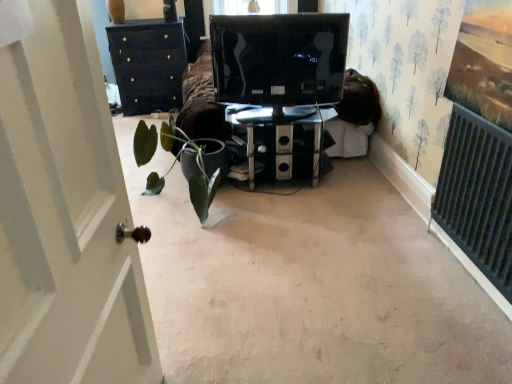
Question: Is transparent glass table at center positioned far away from green matte plant at center?

Choices:
 (A) no
 (B) yes

Answer: (A)

Question: Is transparent glass table at center positioned behind green matte plant at center?

Choices:
 (A) yes
 (B) no

Answer: (A)

Question: From the image's perspective, would you say transparent glass table at center is shown under green matte plant at center?

Choices:
 (A) yes
 (B) no

Answer: (B)

Question: Is transparent glass table at center at the left side of green matte plant at center?

Choices:
 (A) yes
 (B) no

Answer: (B)

Question: From a real-world perspective, does transparent glass table at center stand above green matte plant at center?

Choices:
 (A) yes
 (B) no

Answer: (B)

Question: Can you confirm if transparent glass table at center is smaller than green matte plant at center?

Choices:
 (A) yes
 (B) no

Answer: (A)

Question: Is green matte plant at center in contact with transparent glass table at center?

Choices:
 (A) yes
 (B) no

Answer: (B)

Question: Is green matte plant at center outside of transparent glass table at center?

Choices:
 (A) no
 (B) yes

Answer: (B)

Question: From the image's perspective, is green matte plant at center above transparent glass table at center?

Choices:
 (A) yes
 (B) no

Answer: (B)

Question: Would you say green matte plant at center is a long distance from transparent glass table at center?

Choices:
 (A) yes
 (B) no

Answer: (B)

Question: Is green matte plant at center closer to the viewer compared to transparent glass table at center?

Choices:
 (A) no
 (B) yes

Answer: (B)

Question: Is green matte plant at center surrounding transparent glass table at center?

Choices:
 (A) no
 (B) yes

Answer: (A)

Question: Is black glossy monitor at center oriented towards green matte plant at center?

Choices:
 (A) yes
 (B) no

Answer: (B)